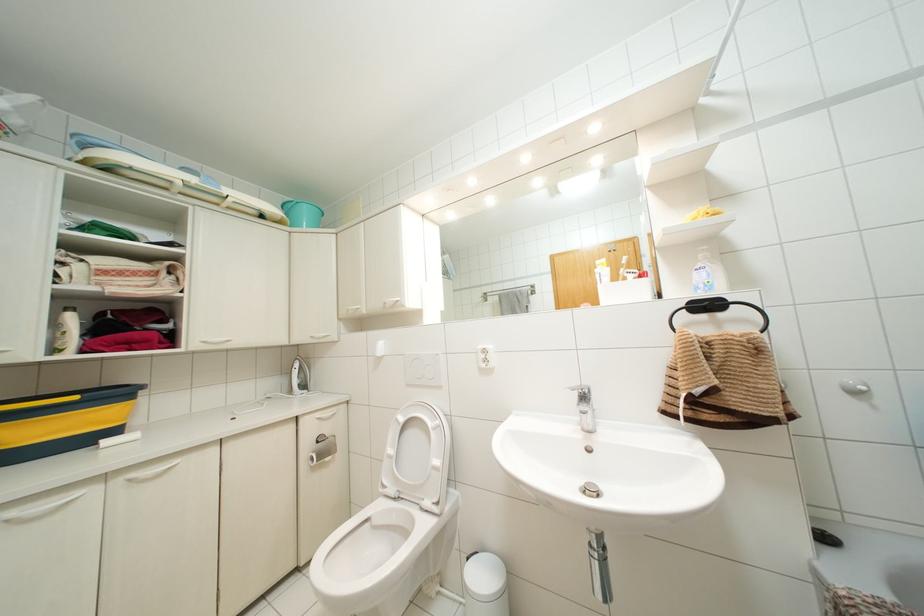
Where is `white lotion bottle`? white lotion bottle is located at coordinates (708, 274).